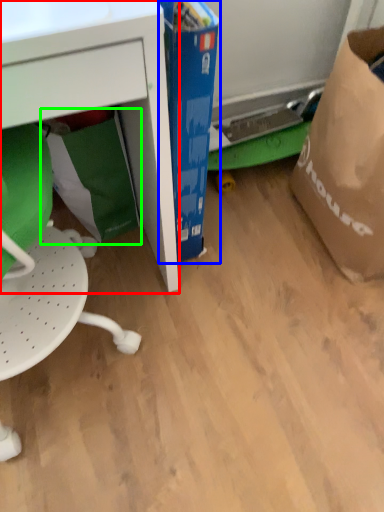
Question: Which object is the farthest from desk (highlighted by a red box)? Choose among these: cardboard box (highlighted by a blue box) or grocery bag (highlighted by a green box).

Choices:
 (A) cardboard box
 (B) grocery bag

Answer: (B)